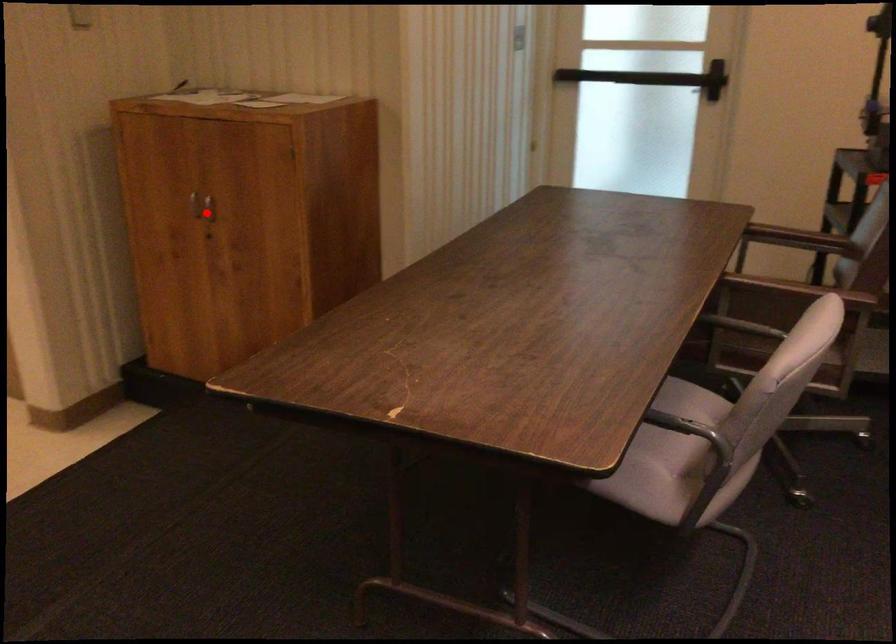
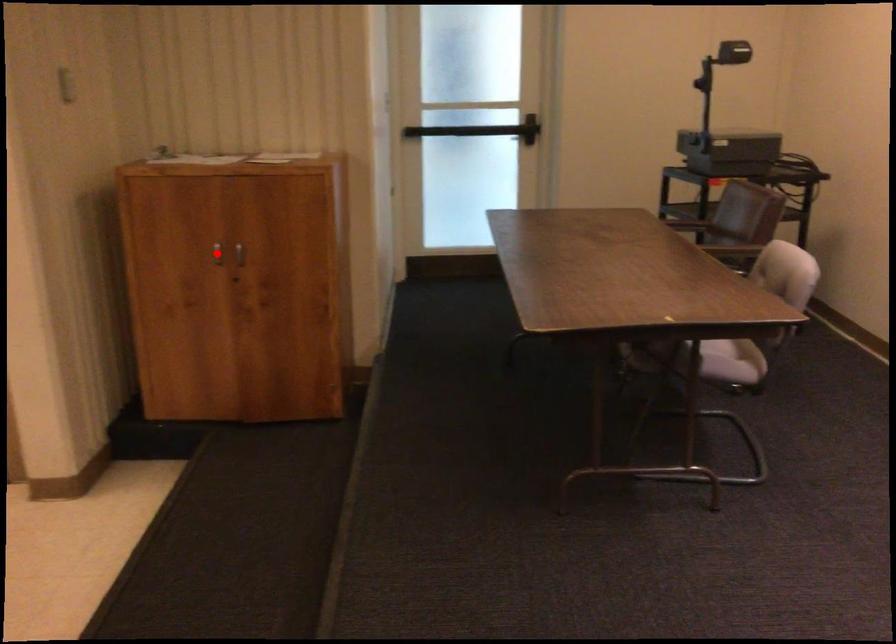
I am providing you with two images of the same scene from different viewpoints. A red point is marked on the first image and another point is marked on the second image. Are the points marked in image1 and image2 representing the same 3D position?

No